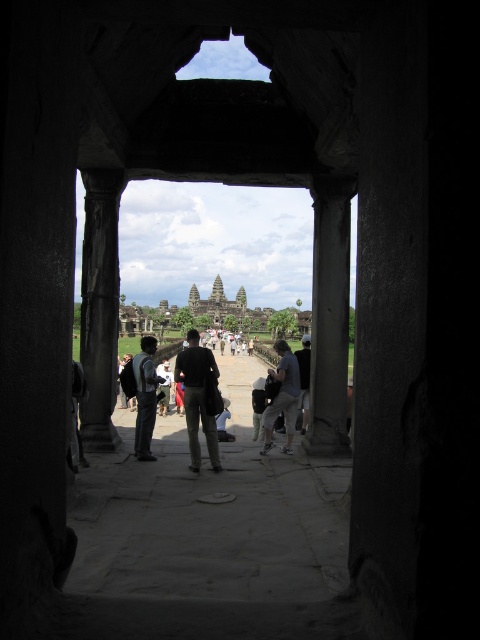
Is dark gray backpack at center to the left of dark gray jacket at center from the viewer's perspective?

Indeed, dark gray backpack at center is positioned on the left side of dark gray jacket at center.

Is dark gray backpack at center below dark gray jacket at center?

Incorrect, dark gray backpack at center is not positioned below dark gray jacket at center.

The height and width of the screenshot is (640, 480). In order to click on dark gray backpack at center in this screenshot , I will do `click(144, 397)`.

Where is `dark gray backpack at center`? dark gray backpack at center is located at coordinates (144, 397).

Is dark gray stone pillar at left bigger than stone temple at center?

No.

Does dark gray stone pillar at left come in front of stone temple at center?

Yes.

Find the location of a particular element. This screenshot has width=480, height=640. dark gray stone pillar at left is located at coordinates (99, 307).

Can you confirm if dark gray stone pillar at center is smaller than dark gray pants at center?

Yes.

Does dark gray stone pillar at center have a lesser height compared to dark gray pants at center?

Incorrect, dark gray stone pillar at center's height does not fall short of dark gray pants at center's.

Measure the distance between dark gray stone pillar at center and camera.

They are 72.50 meters apart.

This screenshot has width=480, height=640. In order to click on dark gray stone pillar at center in this screenshot , I will do `click(330, 316)`.